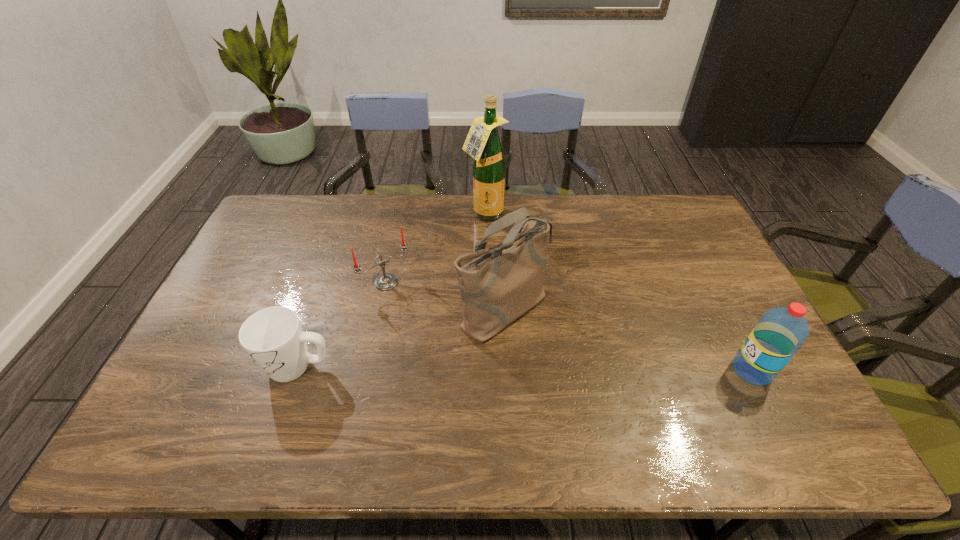
Find the location of a particular element. The width and height of the screenshot is (960, 540). free space on the desktop that is between the leftmost object and the third shortest object and is positioned on the front-facing side of the farthest object is located at coordinates (561, 369).

Locate an element on the screen. vacant space on the desktop that is between the mug and the third tallest object and is positioned on the front-facing side of the fourth object from right to left is located at coordinates (463, 368).

Find the location of a particular element. free spot on the desktop that is between the leftmost object and the rightmost object and is positioned on the front-facing side of the shoulder bag is located at coordinates (584, 369).